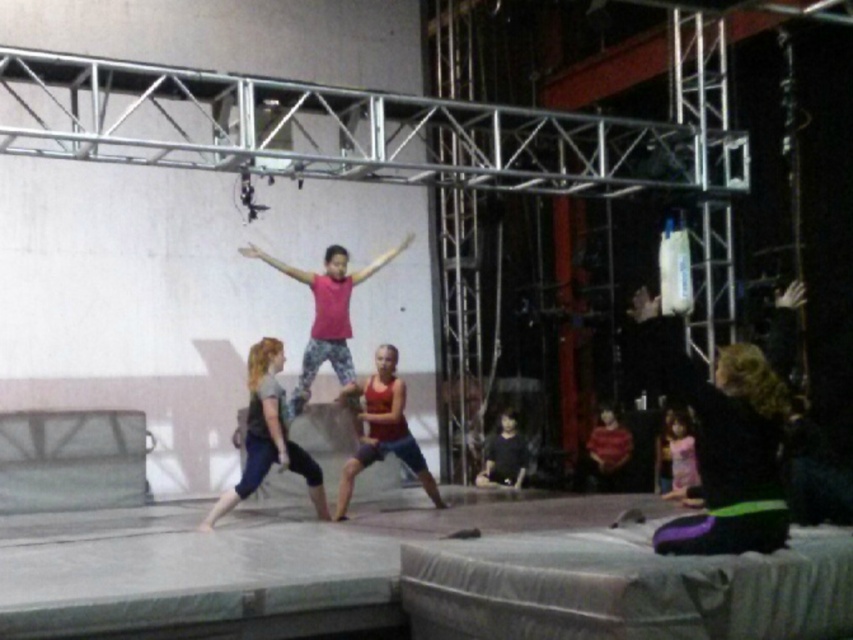
Question: Where is matte gray leggings at center located in relation to red fabric tank top at center in the image?

Choices:
 (A) left
 (B) right

Answer: (A)

Question: Is matte gray leggings at center positioned behind red fabric tank top at center?

Choices:
 (A) yes
 (B) no

Answer: (B)

Question: Which object is farther from the camera taking this photo?

Choices:
 (A) black fabric dress at lower right
 (B) red fabric tank top at center
 (C) matte gray leggings at center

Answer: (B)

Question: Which point is farther from the camera taking this photo?

Choices:
 (A) (364, 449)
 (B) (675, 477)
 (C) (238, 496)
 (D) (762, 477)

Answer: (B)

Question: Can you confirm if black fabric dress at lower right is positioned above red fabric tank top at center?

Choices:
 (A) yes
 (B) no

Answer: (A)

Question: Considering the real-world distances, which object is closest to the red fabric tank top at center?

Choices:
 (A) pink fabric dress at lower right
 (B) black fabric dress at lower right

Answer: (A)